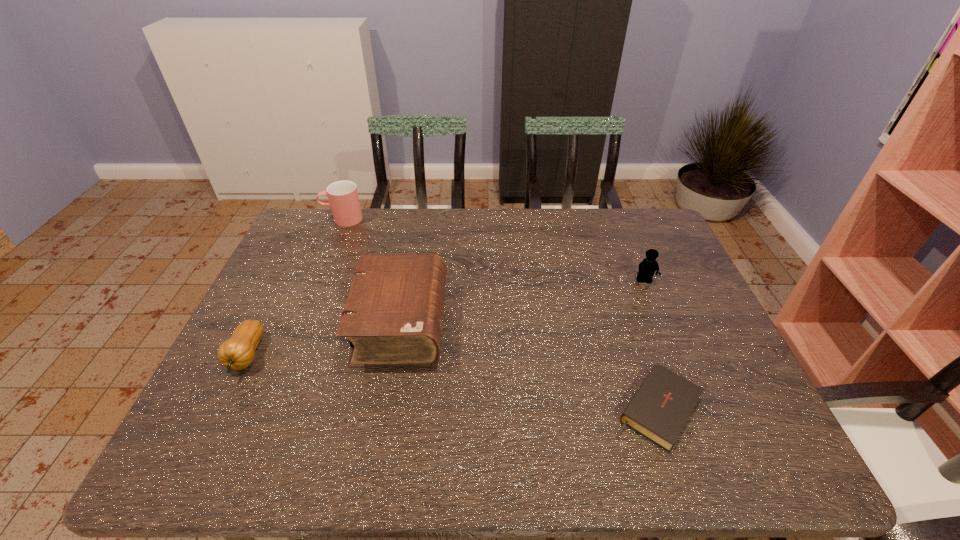
At what (x,y) coordinates should I click in order to perform the action: click on free space between the Lego and the fourth tallest object. Please return your answer as a coordinate pair (x, y). The width and height of the screenshot is (960, 540). Looking at the image, I should click on (445, 318).

You are a GUI agent. You are given a task and a screenshot of the screen. Output one action in this format:
    pyautogui.click(x=<x>, y=<y>)
    Task: Click on the free spot between the left Bible and the nearer Bible
    
    Given the screenshot: What is the action you would take?
    pyautogui.click(x=529, y=366)

At what (x,y) coordinates should I click in order to perform the action: click on vacant point located between the fourth tallest object and the left Bible. Please return your answer as a coordinate pair (x, y). The height and width of the screenshot is (540, 960). Looking at the image, I should click on tap(324, 339).

Where is `vacant space that's between the left Bible and the Lego`? This screenshot has height=540, width=960. vacant space that's between the left Bible and the Lego is located at coordinates 522,302.

The width and height of the screenshot is (960, 540). Identify the location of object that is the fourth closest one to the fourth tallest object. (647, 268).

Find the location of a particular element. The height and width of the screenshot is (540, 960). object that stands as the fourth closest to the fourth tallest object is located at coordinates (647, 268).

Identify the location of free space in the image that satisfies the following two spatial constraints: 1. on the spine side of the third object from right to left; 2. on the left side of the shortest object. (386, 409).

Find the location of a particular element. vacant region that satisfies the following two spatial constraints: 1. on the front-facing side of the Lego; 2. on the spine side of the third object from right to left is located at coordinates (661, 323).